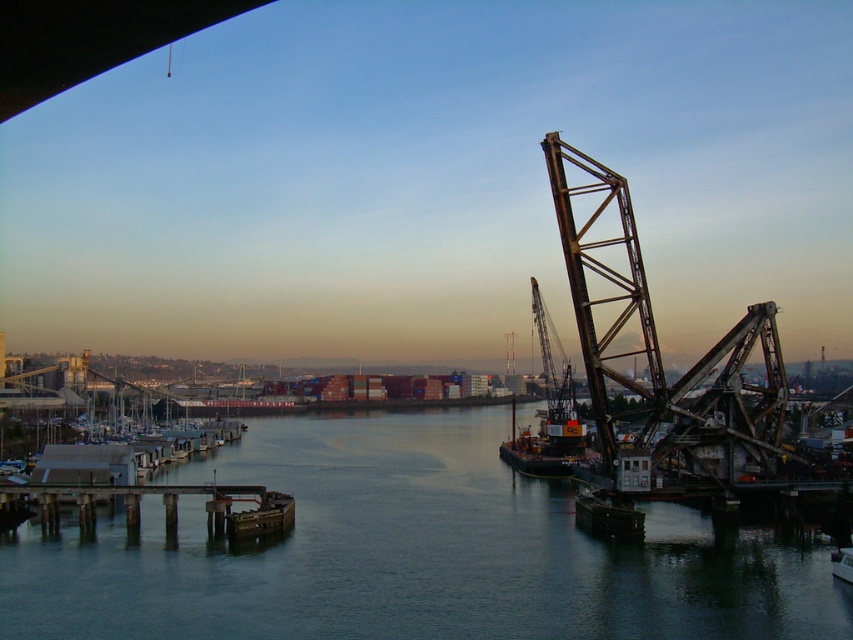
Question: Does dark blue water at center have a lesser width compared to metallic gray crane at center right?

Choices:
 (A) yes
 (B) no

Answer: (B)

Question: Which point appears farthest from the camera in this image?

Choices:
 (A) (524, 461)
 (B) (444, 454)

Answer: (B)

Question: Is dark blue water at center bigger than metallic gray crane at center right?

Choices:
 (A) no
 (B) yes

Answer: (B)

Question: Which object is farther from the camera taking this photo?

Choices:
 (A) dark blue water at center
 (B) metallic gray crane at center right

Answer: (B)

Question: Does dark blue water at center appear on the right side of metallic gray crane at center right?

Choices:
 (A) yes
 (B) no

Answer: (B)